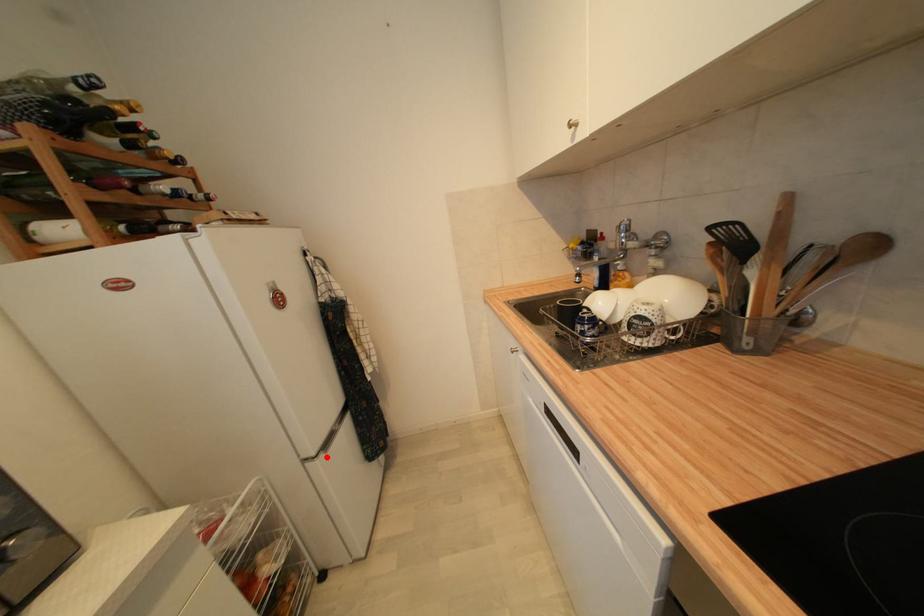
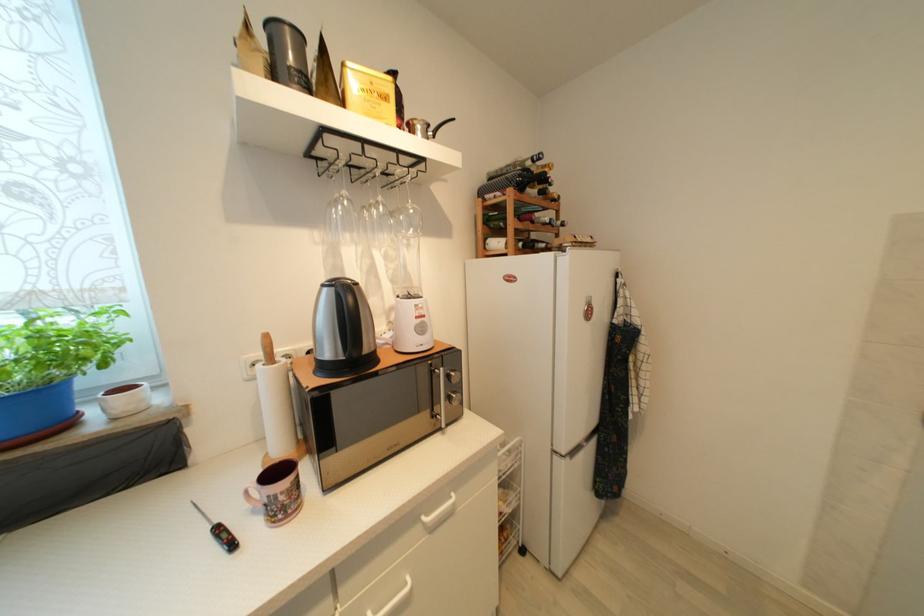
Where in the second image is the point corresponding to the highlighted location from the first image?

(573, 461)